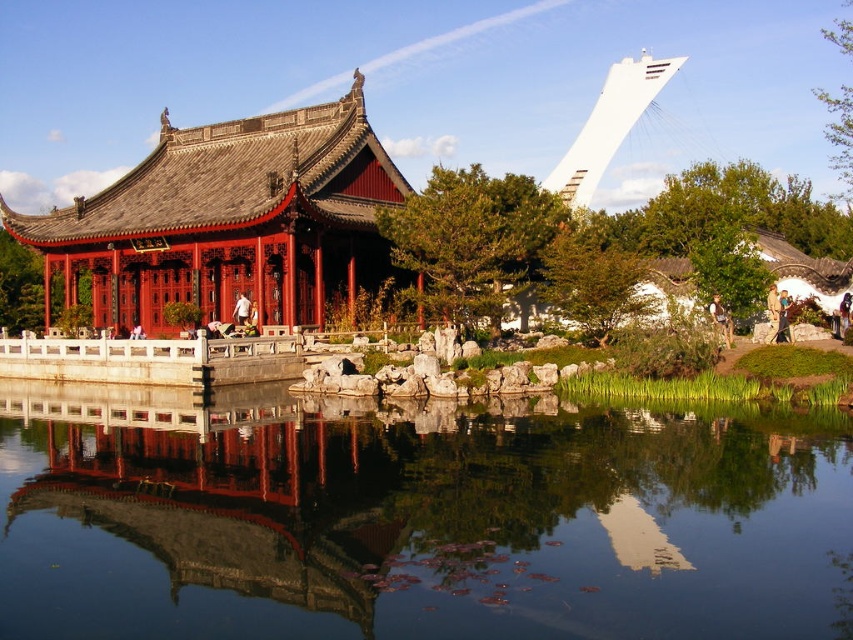
Who is more distant from viewer, (219, 420) or (202, 225)?

Point (202, 225)

Is transparent glass water at center to the left of matte red wood palace at left from the viewer's perspective?

In fact, transparent glass water at center is to the right of matte red wood palace at left.

Which is behind, point (527, 480) or point (151, 195)?

The point (151, 195) is behind.

This screenshot has width=853, height=640. What are the coordinates of `transparent glass water at center` in the screenshot? It's located at (418, 520).